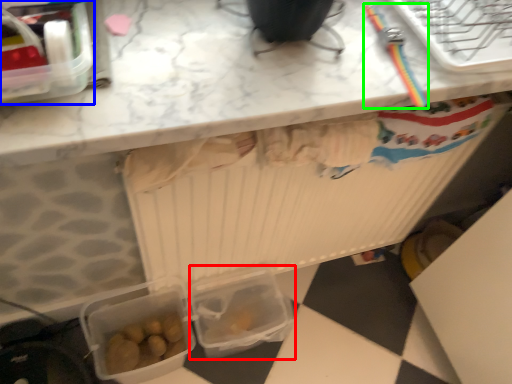
Question: Which object is positioned closest to lunch box (highlighted by a red box)? Select from lunch box (highlighted by a blue box) and tool (highlighted by a green box).

Choices:
 (A) lunch box
 (B) tool

Answer: (B)